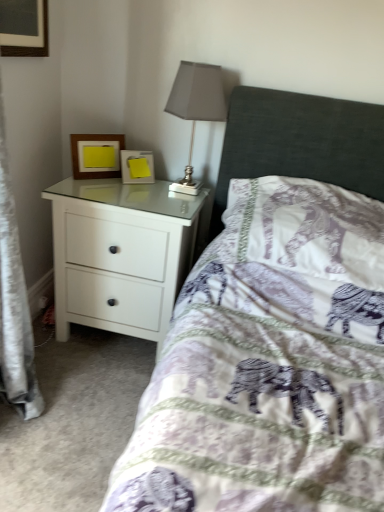
At what (x,y) coordinates should I click in order to perform the action: click on free space to the right of yellow paper at upper left, the 2th picture frame when ordered from left to right. Please return your answer as a coordinate pair (x, y). Looking at the image, I should click on (166, 187).